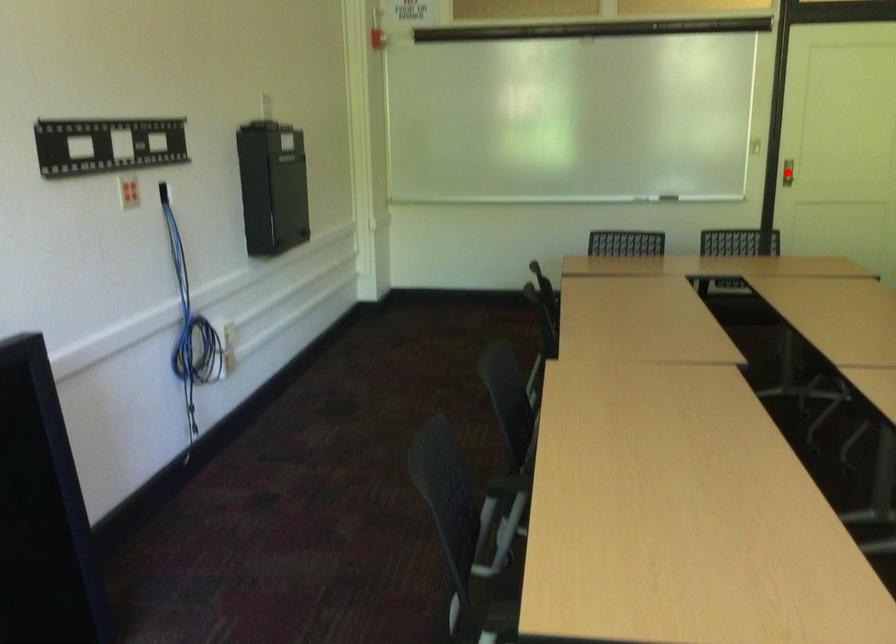
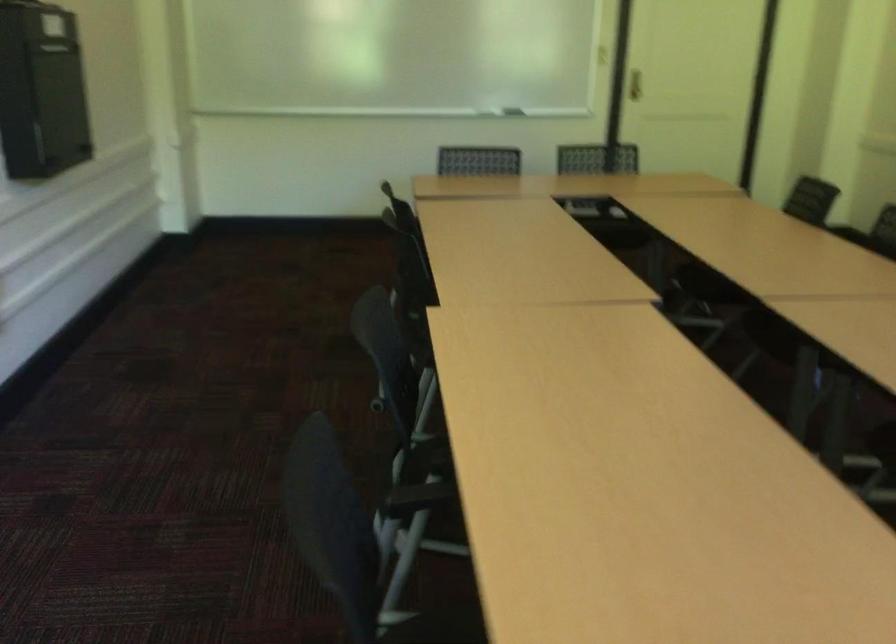
Question: I am providing you with two images of the same scene from different viewpoints. A red point is marked on the first image. Is the red point's position out of view in image 2?

Choices:
 (A) Yes
 (B) No

Answer: (A)